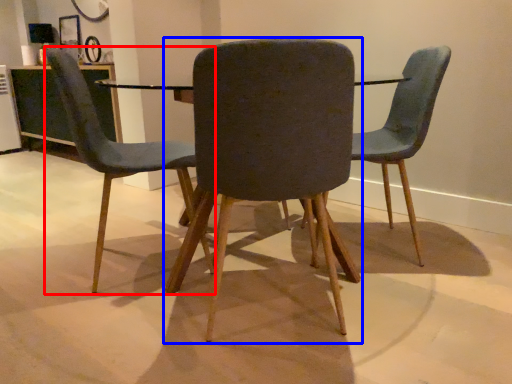
Question: Which of the following is the farthest to the observer, chair (highlighted by a red box) or chair (highlighted by a blue box)?

Choices:
 (A) chair
 (B) chair

Answer: (A)